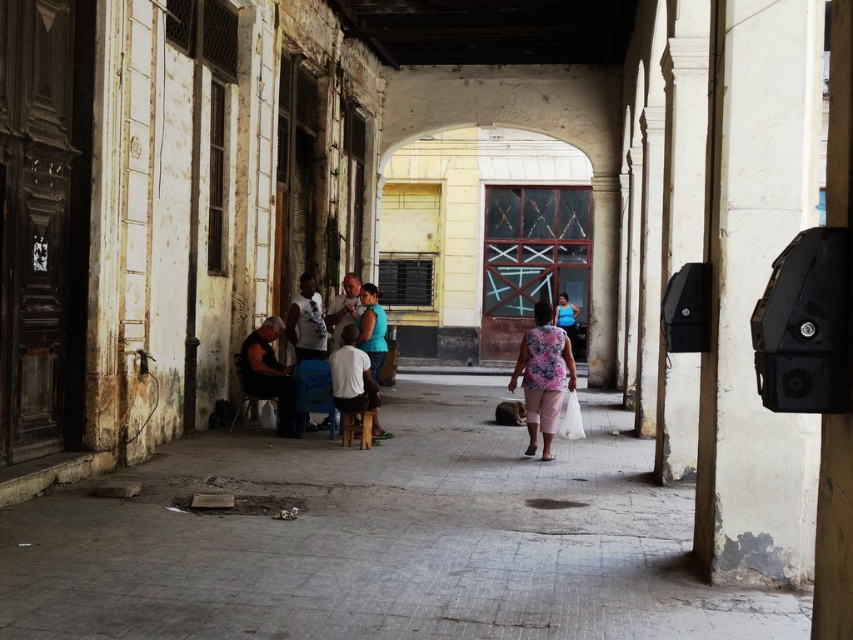
Is concrete floor at center further to the viewer compared to dark blue shirt at center?

No.

Who is more forward, (488, 589) or (357, 371)?

Point (488, 589)

Is point (595, 483) in front of point (352, 401)?

Yes, point (595, 483) is closer to viewer.

I want to click on concrete floor at center, so [x=381, y=540].

Does concrete floor at center have a lesser width compared to dark gray fabric shirt at center-left?

No.

Is concrete floor at center above dark gray fabric shirt at center-left?

Actually, concrete floor at center is below dark gray fabric shirt at center-left.

Who is more forward, (461, 456) or (251, 352)?

Point (461, 456) is in front.

Where is `concrete floor at center`? This screenshot has width=853, height=640. concrete floor at center is located at coordinates (381, 540).

Can you confirm if concrete floor at center is positioned above floral fabric dress at center?

No.

Who is more forward, (769, 634) or (560, 401)?

Point (769, 634)

Locate an element on the screen. The width and height of the screenshot is (853, 640). concrete floor at center is located at coordinates (381, 540).